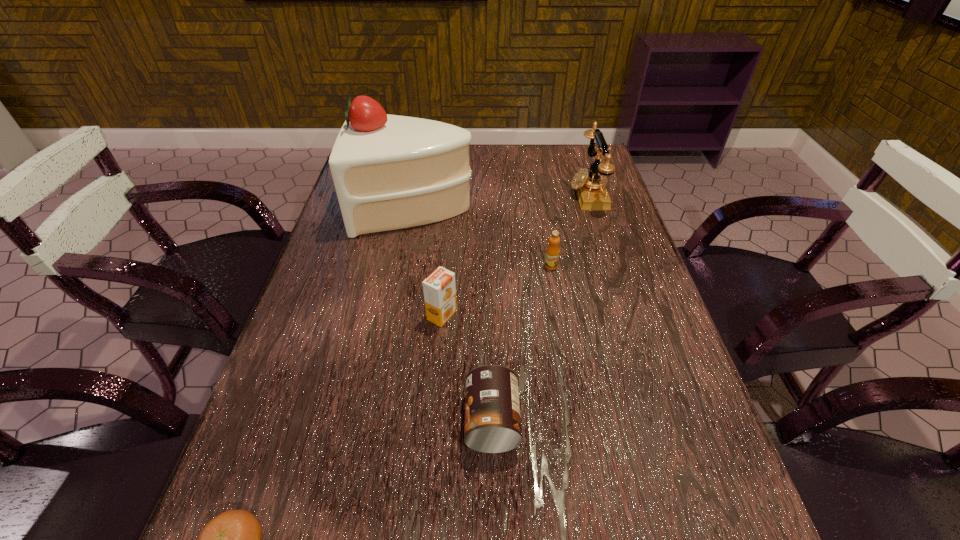
Locate an element on the screen. The width and height of the screenshot is (960, 540). the tallest object is located at coordinates (390, 172).

This screenshot has width=960, height=540. I want to click on the rightmost object, so click(591, 192).

You are a GUI agent. You are given a task and a screenshot of the screen. Output one action in this format:
    pyautogui.click(x=<x>, y=<y>)
    Task: Click on the telephone
    This screenshot has width=960, height=540.
    Given the screenshot: What is the action you would take?
    pyautogui.click(x=591, y=192)

Identify the location of the third nearest object. (439, 288).

At what (x,y) coordinates should I click in order to perform the action: click on the nearer orange juice. Please return your answer as a coordinate pair (x, y). The width and height of the screenshot is (960, 540). Looking at the image, I should click on (439, 288).

Where is `the fourth nearest object`? This screenshot has width=960, height=540. the fourth nearest object is located at coordinates (552, 252).

Identify the location of the second object from right to left. (552, 252).

This screenshot has height=540, width=960. Find the location of `the second nearest object`. the second nearest object is located at coordinates pos(492,412).

Identify the location of can. The width and height of the screenshot is (960, 540). (492, 412).

You are a GUI agent. You are given a task and a screenshot of the screen. Output one action in this format:
    pyautogui.click(x=<x>, y=<y>)
    Task: Click on the vacant space located 0.300m on the right of the tallest object
    
    Given the screenshot: What is the action you would take?
    pyautogui.click(x=580, y=208)